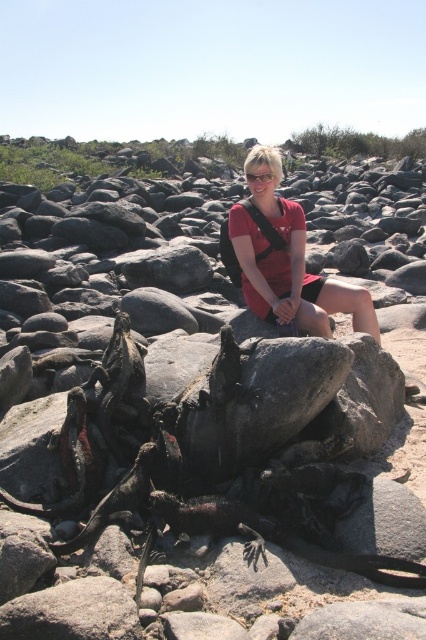
Question: Is matte red dress at center behind clear plastic goggles at center?

Choices:
 (A) yes
 (B) no

Answer: (B)

Question: Is matte red dress at center above clear plastic goggles at center?

Choices:
 (A) yes
 (B) no

Answer: (B)

Question: Which object appears farthest from the camera in this image?

Choices:
 (A) clear plastic goggles at center
 (B) matte red dress at center

Answer: (A)

Question: Can you confirm if matte red dress at center is positioned to the right of clear plastic goggles at center?

Choices:
 (A) yes
 (B) no

Answer: (A)

Question: Among these objects, which one is farthest from the camera?

Choices:
 (A) clear plastic goggles at center
 (B) matte red dress at center

Answer: (A)